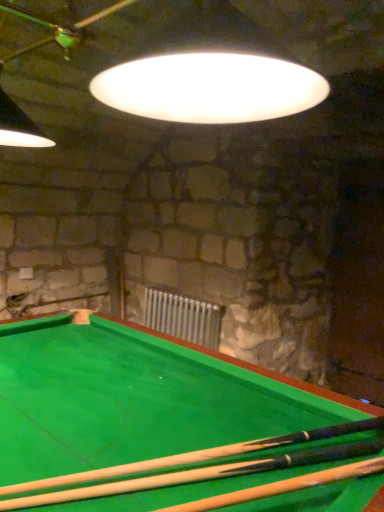
Where is `free location above metallic silver radiator at center (from a real-world perspective)`? free location above metallic silver radiator at center (from a real-world perspective) is located at coordinates (184, 296).